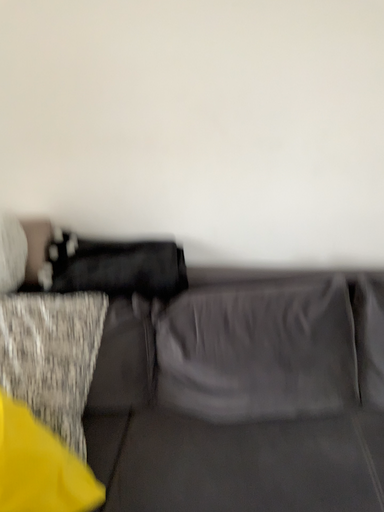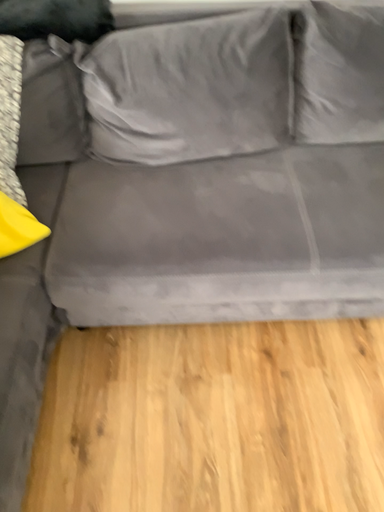
Question: How did the camera likely rotate when shooting the video?

Choices:
 (A) rotated right
 (B) rotated left

Answer: (A)